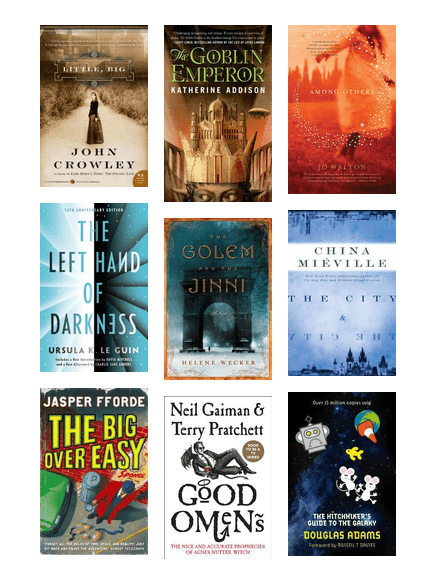
Where is `book covers`? The width and height of the screenshot is (436, 584). book covers is located at coordinates (354, 469), (203, 482), (88, 472), (88, 326), (207, 317), (320, 301), (320, 152), (227, 146), (109, 142).